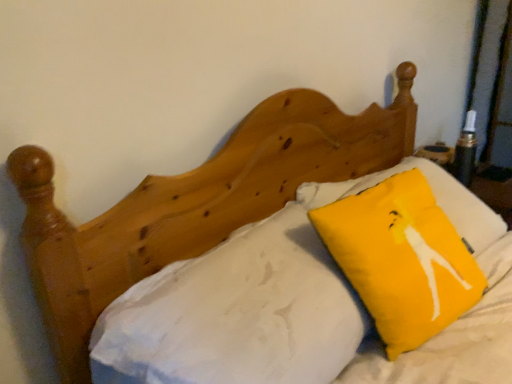
Image resolution: width=512 pixels, height=384 pixels. What do you see at coordinates (401, 259) in the screenshot?
I see `yellow fabric pillow at upper right` at bounding box center [401, 259].

Find the location of a particular element. This screenshot has width=512, height=384. yellow fabric pillow at upper right is located at coordinates coord(401,259).

At what (x,y) coordinates should I click in order to perform the action: click on white cotton sheet at upper center. Please return your answer as a coordinate pair (x, y). The height and width of the screenshot is (384, 512). Looking at the image, I should click on (236, 314).

This screenshot has height=384, width=512. What do you see at coordinates (236, 314) in the screenshot?
I see `white cotton sheet at upper center` at bounding box center [236, 314].

Image resolution: width=512 pixels, height=384 pixels. What are the coordinates of `yellow fabric pillow at upper right` in the screenshot? It's located at (401, 259).

Between yellow fabric pillow at upper right and white cotton sheet at upper center, which one appears on the right side from the viewer's perspective?

yellow fabric pillow at upper right is more to the right.

In the image, is yellow fabric pillow at upper right positioned in front of or behind white cotton sheet at upper center?

In the image, yellow fabric pillow at upper right appears behind white cotton sheet at upper center.

Between point (365, 220) and point (241, 357), which one is positioned behind?

Point (365, 220)

From the image's perspective, is yellow fabric pillow at upper right above white cotton sheet at upper center?

Indeed, from the image's perspective, yellow fabric pillow at upper right is shown above white cotton sheet at upper center.

From a real-world perspective, is yellow fabric pillow at upper right below white cotton sheet at upper center?

No, from a real-world perspective, yellow fabric pillow at upper right is not beneath white cotton sheet at upper center.

Is yellow fabric pillow at upper right wider or thinner than white cotton sheet at upper center?

Clearly, yellow fabric pillow at upper right has less width compared to white cotton sheet at upper center.

Considering the sizes of yellow fabric pillow at upper right and white cotton sheet at upper center in the image, is yellow fabric pillow at upper right taller or shorter than white cotton sheet at upper center?

Clearly, yellow fabric pillow at upper right is shorter compared to white cotton sheet at upper center.

Can you confirm if yellow fabric pillow at upper right is bigger than white cotton sheet at upper center?

No.

Can white cotton sheet at upper center be found inside yellow fabric pillow at upper right?

No, white cotton sheet at upper center is not surrounded by yellow fabric pillow at upper right.

Can you see yellow fabric pillow at upper right touching white cotton sheet at upper center?

No, yellow fabric pillow at upper right is not next to white cotton sheet at upper center.

Does yellow fabric pillow at upper right turn towards white cotton sheet at upper center?

No.

Where is `sheet below the yellow fabric pillow at upper right (from the image's perspective)`? This screenshot has height=384, width=512. sheet below the yellow fabric pillow at upper right (from the image's perspective) is located at coordinates (236, 314).

Based on the photo, considering the relative positions of white cotton sheet at upper center and yellow fabric pillow at upper right in the image provided, is white cotton sheet at upper center to the left of yellow fabric pillow at upper right from the viewer's perspective?

Correct, you'll find white cotton sheet at upper center to the left of yellow fabric pillow at upper right.

Between white cotton sheet at upper center and yellow fabric pillow at upper right, which one is positioned behind?

yellow fabric pillow at upper right is further away from the camera.

Is point (344, 344) farther from viewer compared to point (428, 306)?

No, it is in front of (428, 306).

From the image's perspective, which is below, white cotton sheet at upper center or yellow fabric pillow at upper right?

white cotton sheet at upper center.

In the scene shown: From a real-world perspective, who is located higher, white cotton sheet at upper center or yellow fabric pillow at upper right?

yellow fabric pillow at upper right, from a real-world perspective.

Considering the sizes of objects white cotton sheet at upper center and yellow fabric pillow at upper right in the image provided, who is thinner, white cotton sheet at upper center or yellow fabric pillow at upper right?

yellow fabric pillow at upper right.

Between white cotton sheet at upper center and yellow fabric pillow at upper right, which one has more height?

white cotton sheet at upper center is taller.

Between white cotton sheet at upper center and yellow fabric pillow at upper right, which one has larger size?

Result: With larger size is white cotton sheet at upper center.

Is white cotton sheet at upper center inside the boundaries of yellow fabric pillow at upper right, or outside?

white cotton sheet at upper center cannot be found inside yellow fabric pillow at upper right.

Are white cotton sheet at upper center and yellow fabric pillow at upper right beside each other?

No, white cotton sheet at upper center is not making contact with yellow fabric pillow at upper right.

Based on the photo, could you tell me if white cotton sheet at upper center is turned towards yellow fabric pillow at upper right?

No, white cotton sheet at upper center does not turn towards yellow fabric pillow at upper right.

Find the location of a particular element. Image resolution: width=512 pixels, height=384 pixels. sheet that is on the left side of yellow fabric pillow at upper right is located at coordinates (236, 314).

Where is `sheet below the yellow fabric pillow at upper right (from a real-world perspective)`? sheet below the yellow fabric pillow at upper right (from a real-world perspective) is located at coordinates (236, 314).

Identify the location of sheet in front of the yellow fabric pillow at upper right. (236, 314).